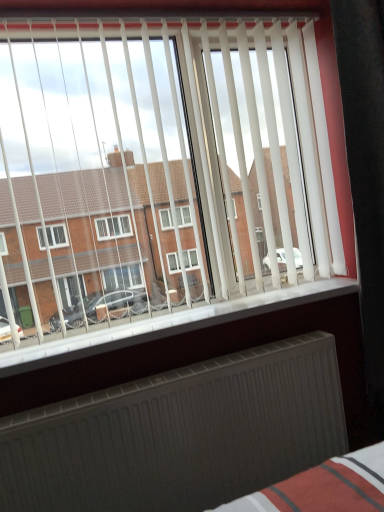
Question: From the image's perspective, is dark gray metallic radiator at bottom over white plastic window sill at lower center?

Choices:
 (A) no
 (B) yes

Answer: (A)

Question: Is the depth of dark gray metallic radiator at bottom greater than that of white plastic window sill at lower center?

Choices:
 (A) yes
 (B) no

Answer: (B)

Question: Considering the relative positions of dark gray metallic radiator at bottom and white plastic window sill at lower center in the image provided, is dark gray metallic radiator at bottom in front of white plastic window sill at lower center?

Choices:
 (A) yes
 (B) no

Answer: (A)

Question: Does dark gray metallic radiator at bottom appear on the right side of white plastic window sill at lower center?

Choices:
 (A) yes
 (B) no

Answer: (B)

Question: Is dark gray metallic radiator at bottom turned away from white plastic window sill at lower center?

Choices:
 (A) yes
 (B) no

Answer: (B)

Question: From a real-world perspective, is dark gray metallic radiator at bottom positioned over white plastic window sill at lower center based on gravity?

Choices:
 (A) yes
 (B) no

Answer: (B)

Question: Is white plastic window sill at lower center to the left of dark gray metallic radiator at bottom from the viewer's perspective?

Choices:
 (A) yes
 (B) no

Answer: (B)

Question: Does white plastic window sill at lower center lie in front of dark gray metallic radiator at bottom?

Choices:
 (A) no
 (B) yes

Answer: (A)

Question: Is white plastic window sill at lower center far from dark gray metallic radiator at bottom?

Choices:
 (A) no
 (B) yes

Answer: (A)

Question: Is white plastic window sill at lower center shorter than dark gray metallic radiator at bottom?

Choices:
 (A) no
 (B) yes

Answer: (B)

Question: Considering the relative sizes of white plastic window sill at lower center and dark gray metallic radiator at bottom in the image provided, is white plastic window sill at lower center thinner than dark gray metallic radiator at bottom?

Choices:
 (A) yes
 (B) no

Answer: (B)

Question: Is white plastic window sill at lower center outside dark gray metallic radiator at bottom?

Choices:
 (A) yes
 (B) no

Answer: (A)

Question: From a real-world perspective, is dark gray metallic radiator at bottom above or below white plastic window sill at lower center?

Choices:
 (A) above
 (B) below

Answer: (B)